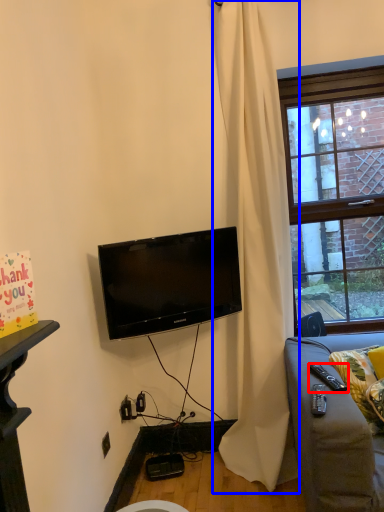
Question: Which object is further to the camera taking this photo, remote control (highlighted by a red box) or curtain (highlighted by a blue box)?

Choices:
 (A) remote control
 (B) curtain

Answer: (B)